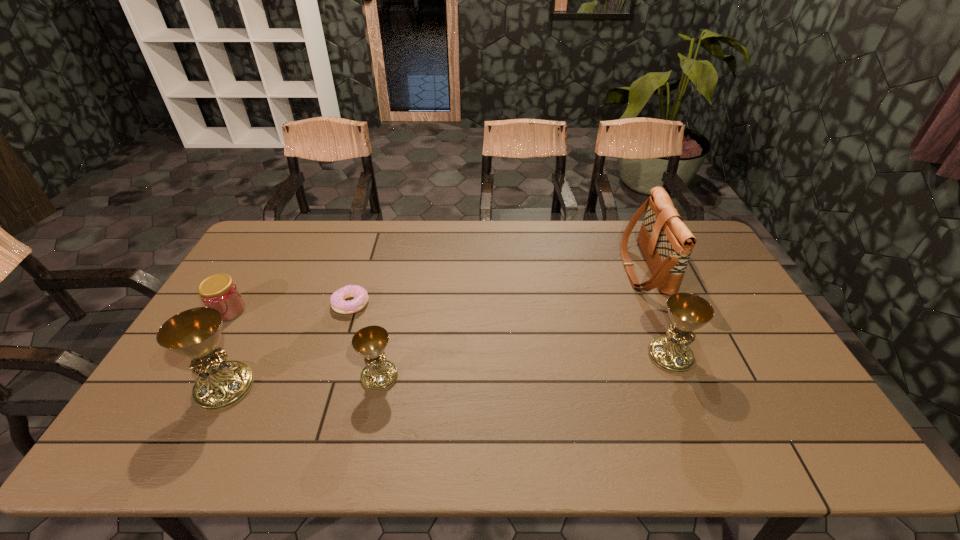
Please mark a free spot for a new chalice to balance the arrangement. Please provide its 2D coordinates. Your answer should be formatted as a tuple, i.e. [(x, y)], where the tuple contains the x and y coordinates of a point satisfying the conditions above.

[(528, 366)]